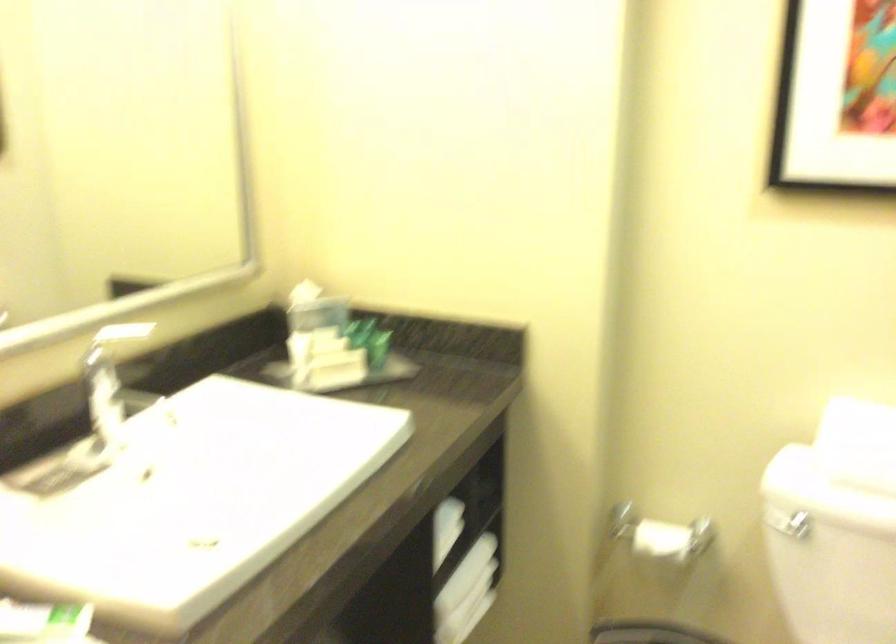
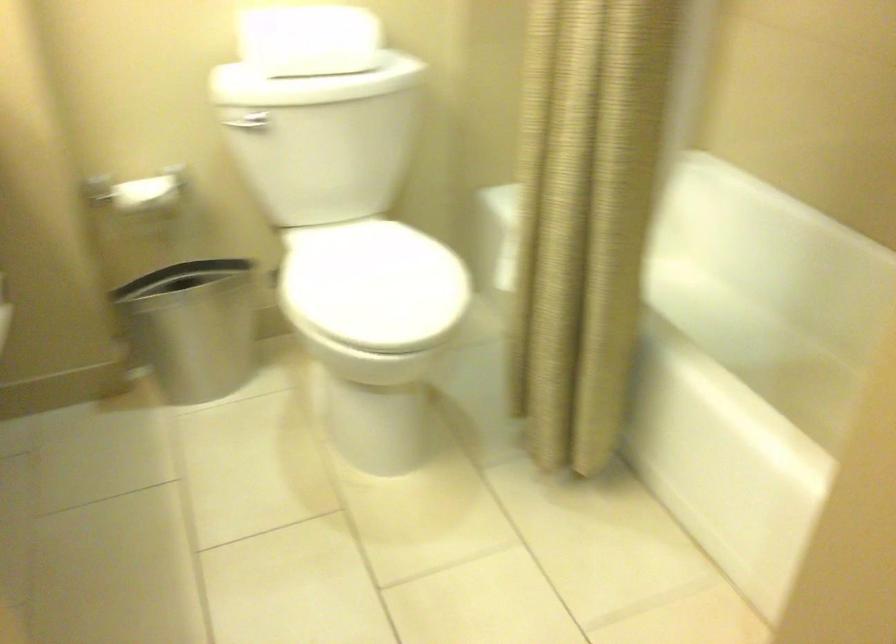
How did the camera likely rotate?

The rotation direction of the camera is right-down.